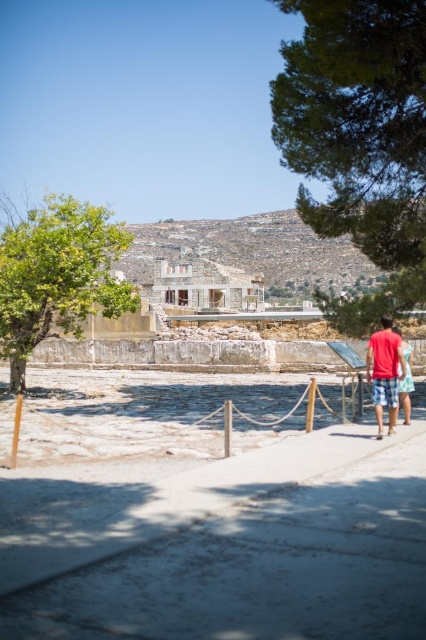
Who is lower down, green textured tree at upper right or light blue denim shorts at center?

light blue denim shorts at center is below.

The height and width of the screenshot is (640, 426). What do you see at coordinates (359, 138) in the screenshot?
I see `green textured tree at upper right` at bounding box center [359, 138].

You are a GUI agent. You are given a task and a screenshot of the screen. Output one action in this format:
    pyautogui.click(x=<x>, y=<y>)
    Task: Click on the green textured tree at upper right
    This screenshot has width=426, height=640.
    Given the screenshot: What is the action you would take?
    pyautogui.click(x=359, y=138)

Describe the element at coordinates (221, 544) in the screenshot. The height and width of the screenshot is (640, 426). I see `gray concrete pavement at center` at that location.

Is gray concrete pavement at center positioned before green leafy tree at left?

Yes, gray concrete pavement at center is closer to the viewer.

Locate an element on the screen. gray concrete pavement at center is located at coordinates (221, 544).

Who is positioned more to the left, green textured tree at upper right or red cotton shirt at right?

red cotton shirt at right is more to the left.

Is the position of green textured tree at upper right less distant than that of red cotton shirt at right?

No, it is not.

Is point (423, 67) positioned in front of point (388, 380)?

That is False.

Locate an element on the screen. The height and width of the screenshot is (640, 426). green textured tree at upper right is located at coordinates (359, 138).